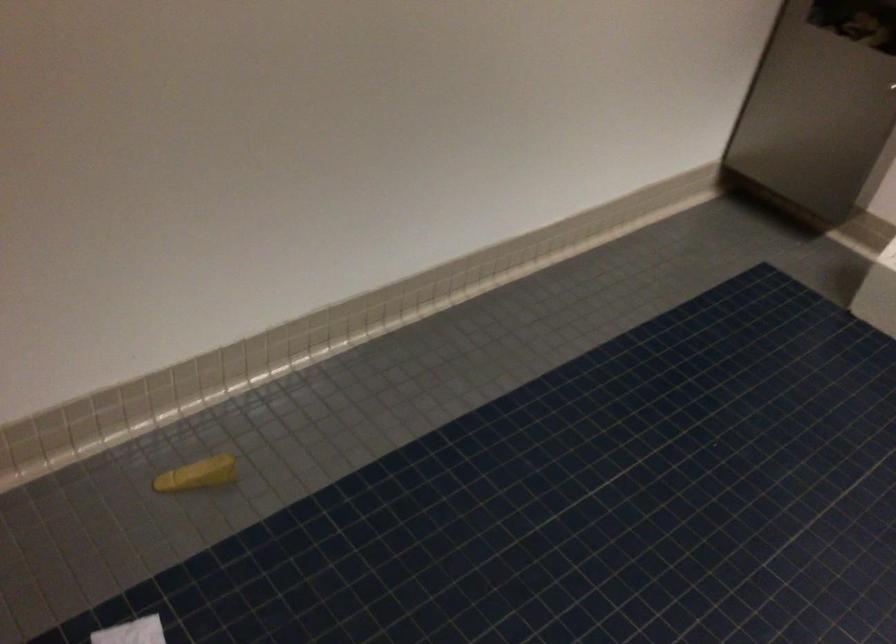
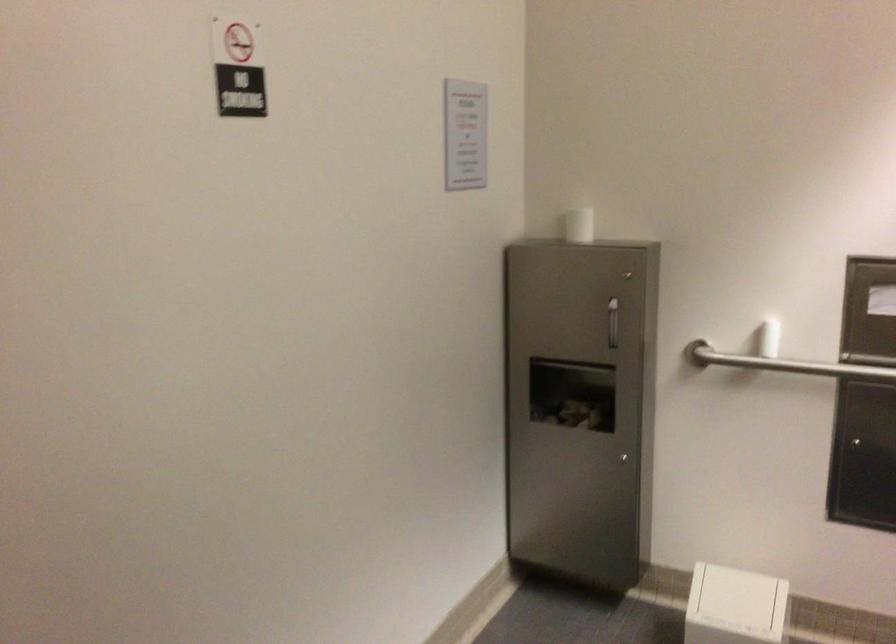
The images are taken continuously from a first-person perspective. In which direction is your viewpoint rotating?

The camera's rotation is toward right-up.